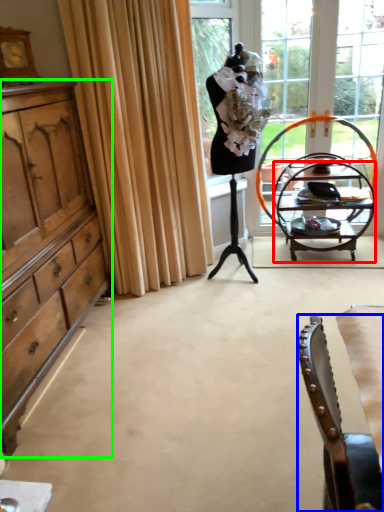
Question: Which object is the closest to the desk (highlighted by a red box)? Choose among these: chair (highlighted by a blue box) or cabinetry (highlighted by a green box).

Choices:
 (A) chair
 (B) cabinetry

Answer: (B)